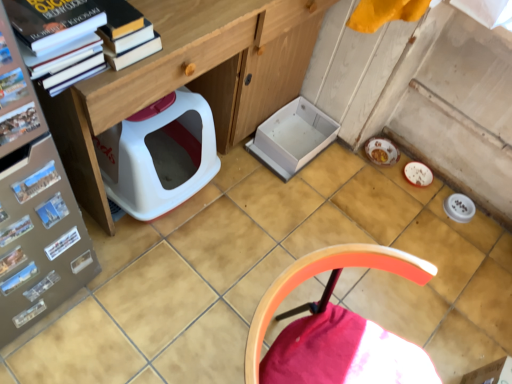
Describe the element at coordinates (190, 77) in the screenshot. The width and height of the screenshot is (512, 384). I see `matte wood desk at center` at that location.

Identify the location of matte wood desk at center. The height and width of the screenshot is (384, 512). (190, 77).

This screenshot has width=512, height=384. Describe the element at coordinates (12, 87) in the screenshot. I see `matte cardboard magazine at left, the seventh magazine when ordered from back to front` at that location.

Where is `wooden chair at lower right`? The height and width of the screenshot is (384, 512). wooden chair at lower right is located at coordinates (x=337, y=328).

This screenshot has height=384, width=512. I want to click on metallic silver magazine at left, the third magazine positioned from the back, so click(x=52, y=210).

In order to click on matte wood desk at center in this screenshot , I will do `click(190, 77)`.

From a real-world perspective, starting from the metallic silver magazine at lower left, the first magazine positioned from the back, which paperback book is the 1st one vertically above it? Please provide its 2D coordinates.

[(62, 243)]

Is white matte paper at left, the first paperback book positioned from the bottom, closer to the viewer compared to metallic silver magazine at lower left, the 7th magazine when ordered from front to back?

Yes, it is.

Are white matte paper at left, positioned as the second paperback book in top-to-bottom order, and metallic silver magazine at lower left, the first magazine positioned from the back, located far from each other?

No.

Considering the sizes of white matte paper at left, which ranks as the first paperback book in back-to-front order, and metallic silver magazine at lower left, the 7th magazine when ordered from front to back, in the image, is white matte paper at left, which ranks as the first paperback book in back-to-front order, taller or shorter than metallic silver magazine at lower left, the 7th magazine when ordered from front to back,?

Considering their sizes, white matte paper at left, which ranks as the first paperback book in back-to-front order, has less height than metallic silver magazine at lower left, the 7th magazine when ordered from front to back.

From the picture: Considering the relative sizes of wooden chair at lower right and metallic silver magazine at left, which is the fifth magazine in front-to-back order, in the image provided, is wooden chair at lower right smaller than metallic silver magazine at left, which is the fifth magazine in front-to-back order,?

Actually, wooden chair at lower right might be larger than metallic silver magazine at left, which is the fifth magazine in front-to-back order.

Is the surface of wooden chair at lower right in direct contact with metallic silver magazine at left, the third magazine positioned from the back?

wooden chair at lower right and metallic silver magazine at left, the third magazine positioned from the back, are clearly separated.

From their relative heights in the image, would you say wooden chair at lower right is taller or shorter than metallic silver magazine at left, the third magazine positioned from the back?

Clearly, wooden chair at lower right is taller compared to metallic silver magazine at left, the third magazine positioned from the back.

Can you confirm if wooden chair at lower right is positioned to the right of metallic silver magazine at left, which is the fifth magazine in front-to-back order?

Indeed, wooden chair at lower right is positioned on the right side of metallic silver magazine at left, which is the fifth magazine in front-to-back order.

Is metallic glossy magazine at lower left, arranged as the 4th magazine when viewed from the front, next to metallic glossy magazine at left, which ranks as the 6th magazine in back-to-front order, and touching it?

No, metallic glossy magazine at lower left, arranged as the 4th magazine when viewed from the front, is not beside metallic glossy magazine at left, which ranks as the 6th magazine in back-to-front order.

Which object is thinner, metallic glossy magazine at lower left, arranged as the 4th magazine when viewed from the front, or metallic glossy magazine at left, which ranks as the 6th magazine in back-to-front order?

With smaller width is metallic glossy magazine at lower left, arranged as the 4th magazine when viewed from the front.

Could you tell me if metallic glossy magazine at lower left, which is the 4th magazine in back-to-front order, is turned towards metallic glossy magazine at left, positioned as the 2th magazine in front-to-back order?

No, metallic glossy magazine at lower left, which is the 4th magazine in back-to-front order, is not facing towards metallic glossy magazine at left, positioned as the 2th magazine in front-to-back order.

Does blue matte postcard at left, the second paperback book in the bottom-to-top sequence, have a larger size compared to wooden chair at lower right?

Actually, blue matte postcard at left, the second paperback book in the bottom-to-top sequence, might be smaller than wooden chair at lower right.

Are blue matte postcard at left, the second paperback book in the bottom-to-top sequence, and wooden chair at lower right beside each other?

No, blue matte postcard at left, the second paperback book in the bottom-to-top sequence, is not in contact with wooden chair at lower right.

Is point (47, 176) behind point (324, 323)?

No, (47, 176) is in front of (324, 323).

Where is `the 2nd paperback book positioned above the wooden chair at lower right (from the image's perspective)`? This screenshot has width=512, height=384. the 2nd paperback book positioned above the wooden chair at lower right (from the image's perspective) is located at coordinates (36, 182).

I want to click on magazine that is the 3rd one when counting backward from the matte cardboard magazine at left, which is the 1th magazine in front-to-back order, so click(11, 260).

From the image's perspective, who appears lower, metallic glossy magazine at lower left, which is the 4th magazine in back-to-front order, or matte cardboard magazine at left, the seventh magazine when ordered from back to front?

metallic glossy magazine at lower left, which is the 4th magazine in back-to-front order, is shown below in the image.

In terms of size, does metallic glossy magazine at lower left, arranged as the 4th magazine when viewed from the front, appear bigger or smaller than matte cardboard magazine at left, which is the 1th magazine in front-to-back order?

In the image, metallic glossy magazine at lower left, arranged as the 4th magazine when viewed from the front, appears to be smaller than matte cardboard magazine at left, which is the 1th magazine in front-to-back order.

Is hardcover book at upper left, the first book from the top, in contact with metallic silver magazine at left, which is the fifth magazine in front-to-back order?

No, hardcover book at upper left, the first book from the top, is not in contact with metallic silver magazine at left, which is the fifth magazine in front-to-back order.

Is hardcover book at upper left, arranged as the 2th book when viewed from the back, outside of metallic silver magazine at left, which is the fifth magazine in front-to-back order?

hardcover book at upper left, arranged as the 2th book when viewed from the back, lies outside metallic silver magazine at left, which is the fifth magazine in front-to-back order,'s area.

How many degrees apart are the facing directions of hardcover book at upper left, the first book from the top, and metallic silver magazine at left, the third magazine positioned from the back?

The angle between the facing direction of hardcover book at upper left, the first book from the top, and the facing direction of metallic silver magazine at left, the third magazine positioned from the back, is 0.00172 degrees.

Does hardcover book at upper left, positioned as the 2th book in bottom-to-top order, come in front of metallic silver magazine at left, which is the fifth magazine in front-to-back order?

Yes, hardcover book at upper left, positioned as the 2th book in bottom-to-top order, is in front of metallic silver magazine at left, which is the fifth magazine in front-to-back order.

From a real-world perspective, is metallic silver magazine at lower left, the 7th magazine when ordered from front to back, over wooden chair at lower right?

Actually, metallic silver magazine at lower left, the 7th magazine when ordered from front to back, is physically below wooden chair at lower right in the real world.

Is metallic silver magazine at lower left, the first magazine positioned from the back, to the left of wooden chair at lower right from the viewer's perspective?

Yes.

From a real-world perspective, starting from the wooden chair at lower right, which magazine is the 2nd one below it? Please provide its 2D coordinates.

[(42, 286)]

Can wooden chair at lower right be found inside metallic silver magazine at lower left, the first magazine positioned from the back?

Definitely not — wooden chair at lower right is not inside metallic silver magazine at lower left, the first magazine positioned from the back.

Find the location of a particular element. The height and width of the screenshot is (384, 512). the 3rd magazine below the white matte paper at left, placed as the second paperback book when sorted from front to back (from the image's perspective) is located at coordinates (42, 286).

Find the location of a particular element. The width and height of the screenshot is (512, 384). the 5th magazine behind when counting from the wooden chair at lower right is located at coordinates (52, 210).

In the scene shown: From the image, which object appears to be farther from wooden chair at lower right, hardcover book at upper left, the first book from the top, or blue matte postcard at left, the 1th paperback book positioned from the front?

blue matte postcard at left, the 1th paperback book positioned from the front, is positioned further to the anchor wooden chair at lower right.

Looking at the image, which one is located further to metallic glossy magazine at lower left, acting as the 2th magazine starting from the back, metallic silver magazine at lower left, the first magazine positioned from the back, or white matte paper at left, which ranks as the first paperback book in back-to-front order?

The object further to metallic glossy magazine at lower left, acting as the 2th magazine starting from the back, is metallic silver magazine at lower left, the first magazine positioned from the back.

Looking at the image, which one is located closer to white matte book at lower left, which is the 2th book in front-to-back order, matte cardboard magazine at left, the seventh magazine when ordered from back to front, or blue matte postcard at left, acting as the 1th paperback book starting from the top?

blue matte postcard at left, acting as the 1th paperback book starting from the top, is positioned closer to the anchor white matte book at lower left, which is the 2th book in front-to-back order.

Considering their positions, is hardcover book at upper left, which appears as the 1th book when viewed from the front, positioned further to metallic glossy magazine at lower left, acting as the 2th magazine starting from the back, than metallic glossy magazine at lower left, which ranks as the fifth magazine in back-to-front order?

hardcover book at upper left, which appears as the 1th book when viewed from the front.

Consider the image. When comparing their distances from metallic glossy magazine at lower left, arranged as the 4th magazine when viewed from the front, does blue matte postcard at left, the 1th paperback book positioned from the front, or metallic silver magazine at left, which is the fifth magazine in front-to-back order, seem further?

blue matte postcard at left, the 1th paperback book positioned from the front, is further to metallic glossy magazine at lower left, arranged as the 4th magazine when viewed from the front.

Based on their spatial positions, is metallic silver magazine at lower left, the first magazine positioned from the back, or metallic glossy magazine at lower left, acting as the 2th magazine starting from the back, further from metallic glossy magazine at left, positioned as the 2th magazine in front-to-back order?

metallic silver magazine at lower left, the first magazine positioned from the back.

Estimate the real-world distances between objects in this image. Which object is closer to metallic glossy magazine at lower left, which is the 4th magazine in back-to-front order, white matte paper at left, which ranks as the first paperback book in back-to-front order, or hardcover book at upper left, the first book from the top?

white matte paper at left, which ranks as the first paperback book in back-to-front order, is closer to metallic glossy magazine at lower left, which is the 4th magazine in back-to-front order.

From the image, which object appears to be nearer to metallic glossy magazine at left, which ranks as the 6th magazine in back-to-front order, matte wood desk at center or matte cardboard magazine at left, which is the 1th magazine in front-to-back order?

matte cardboard magazine at left, which is the 1th magazine in front-to-back order, is positioned closer to the anchor metallic glossy magazine at left, which ranks as the 6th magazine in back-to-front order.

Locate an element on the screen. The image size is (512, 384). paperback book between metallic glossy magazine at lower left, arranged as the 4th magazine when viewed from the front, and metallic silver magazine at lower left, the 7th magazine when ordered from front to back, along the z-axis is located at coordinates (62, 243).

This screenshot has height=384, width=512. Identify the location of paperback book between metallic glossy magazine at lower left, which ranks as the fifth magazine in back-to-front order, and metallic silver magazine at lower left, the first magazine positioned from the back, in the front-back direction. (62, 243).

You are a GUI agent. You are given a task and a screenshot of the screen. Output one action in this format:
    pyautogui.click(x=<x>, y=<y>)
    Task: Click on the paperback book between metallic silver magazine at left, which is the fifth magazine in front-to-back order, and metallic silver magazine at lower left, the 7th magazine when ordered from front to back, from top to bottom
    The height and width of the screenshot is (384, 512).
    Given the screenshot: What is the action you would take?
    pyautogui.click(x=62, y=243)

Locate an element on the screen. The height and width of the screenshot is (384, 512). paperback book between metallic silver magazine at left, which is the fifth magazine in front-to-back order, and wooden chair at lower right from left to right is located at coordinates (36, 182).